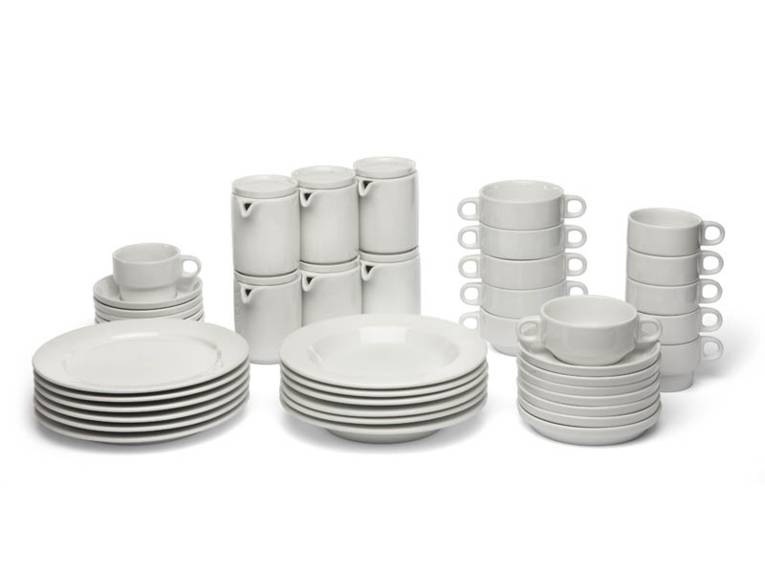
Locate an element on the screen. Image resolution: width=765 pixels, height=574 pixels. bowls is located at coordinates (392, 430), (376, 422), (435, 409), (422, 398), (376, 397), (376, 385).